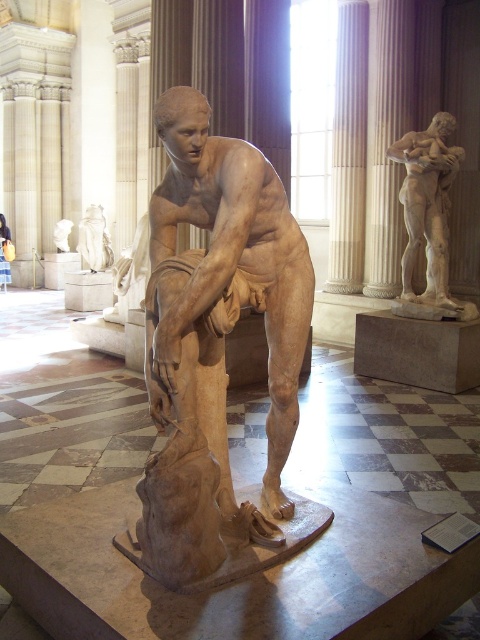
Question: Is white marble statue at upper right positioned at the back of white marble statue at center?

Choices:
 (A) no
 (B) yes

Answer: (A)

Question: Which point is closer to the camera?

Choices:
 (A) white marble column at center
 (B) white marble statue at upper right
 (C) white marble statue at center
 (D) white marble statue at upper left

Answer: (B)

Question: Which of the following is the closest to the observer?

Choices:
 (A) (360, 147)
 (B) (216, 467)
 (C) (101, 268)

Answer: (B)

Question: Among these objects, which one is farthest from the camera?

Choices:
 (A) white marble statue at upper right
 (B) white marble statue at center

Answer: (B)

Question: Does white marble column at center appear on the right side of white marble statue at upper right?

Choices:
 (A) no
 (B) yes

Answer: (A)

Question: Is white marble statue at upper left to the left of white marble statue at center from the viewer's perspective?

Choices:
 (A) no
 (B) yes

Answer: (A)